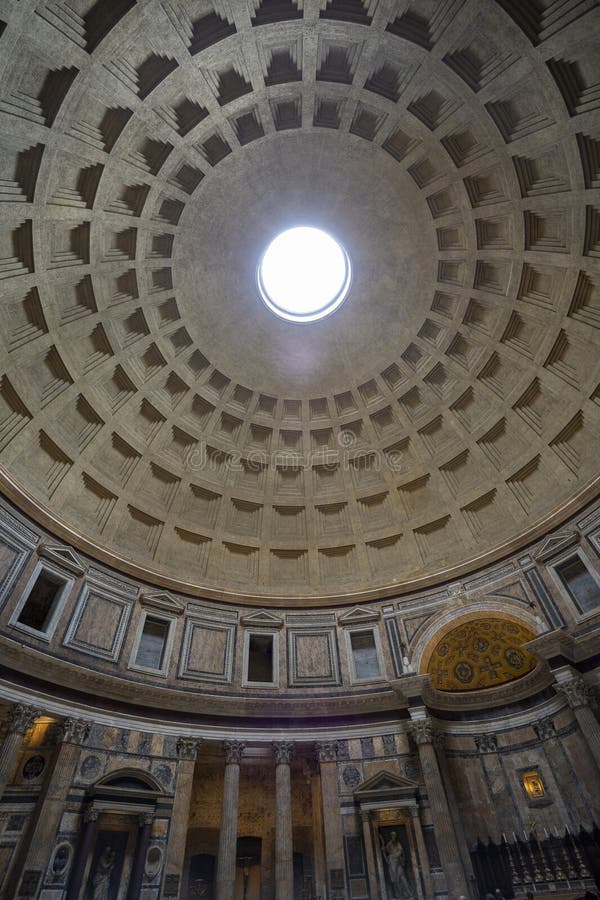
This screenshot has height=900, width=600. What are the coordinates of `window` in the screenshot? It's located at (579, 587), (360, 652), (269, 654), (149, 645), (52, 606).